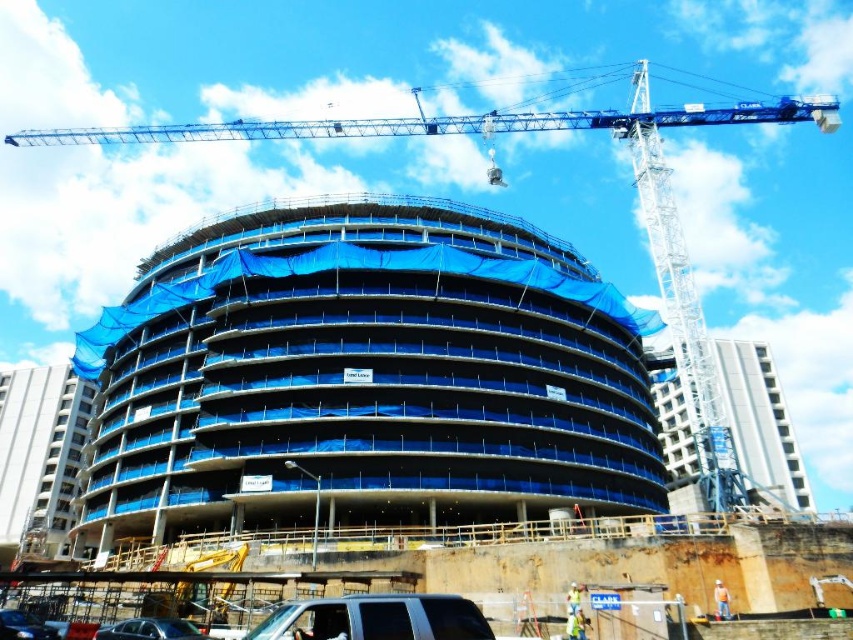
You are a delivery driver approaching the construction site. You see a blue metallic crane at upper center and a matte black suv at lower center. Which object is located to the right of the other?

The blue metallic crane at upper center is positioned on the right side of matte black suv at lower center.

You are a construction worker standing at the base of the crane. You notice two points marked on the crane arm. The first point is at coordinate point(268, 637) and the second is at point(106, 628). From your position, which point is closer to you?

Point(268, 637) is in front of point(106, 628), so the first point is closer to you.

You are a construction worker standing at the crane on the right side of the frame. You need to check the stability of the brown concrete wall at lower center. According to the coordinates provided, where exactly should you look to inspect the wall?

The brown concrete wall at lower center is located at point (479, 572), so you should look towards that coordinate to inspect the wall.